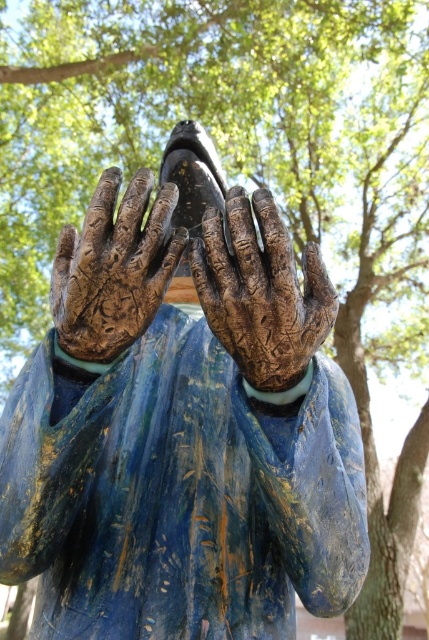
Does point (211, 632) come farther from viewer compared to point (133, 182)?

Yes, point (211, 632) is farther from viewer.

Is bronze textured hands at center smaller than rusty metallic hand at center?

No, bronze textured hands at center is not smaller than rusty metallic hand at center.

Describe the element at coordinates (181, 433) in the screenshot. I see `bronze textured hands at center` at that location.

The height and width of the screenshot is (640, 429). Identify the location of bronze textured hands at center. (x=181, y=433).

Between bronze textured hands at center and rusty metal hand at center, which one appears on the left side from the viewer's perspective?

Positioned to the left is bronze textured hands at center.

Is bronze textured hands at center positioned behind rusty metal hand at center?

Yes.

Is point (271, 465) closer to viewer compared to point (226, 260)?

No, (271, 465) is behind (226, 260).

Identify the location of bronze textured hands at center. This screenshot has height=640, width=429. (181, 433).

Can you confirm if rusty metal hand at center is positioned below rusty metallic hand at center?

Indeed, rusty metal hand at center is positioned under rusty metallic hand at center.

Which is below, rusty metal hand at center or rusty metallic hand at center?

rusty metal hand at center

The height and width of the screenshot is (640, 429). Describe the element at coordinates (260, 292) in the screenshot. I see `rusty metal hand at center` at that location.

At what (x,y) coordinates should I click in order to perform the action: click on rusty metal hand at center. Please return your answer as a coordinate pair (x, y). The width and height of the screenshot is (429, 640). Looking at the image, I should click on (260, 292).